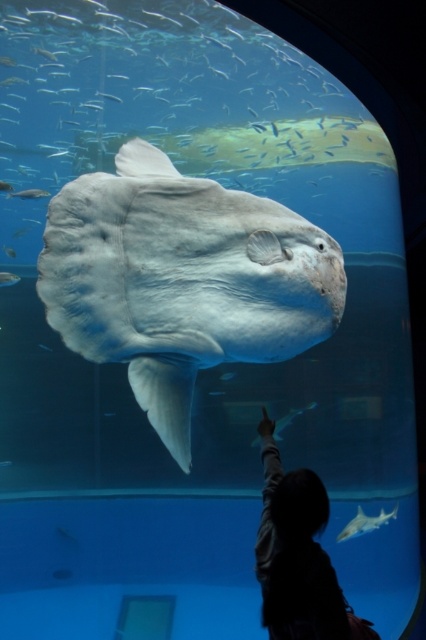
You are a marine biologist observing the aquarium tank. You notice the smooth gray shark at center and the translucent white fish at upper center. Which of these two marine creatures is positioned higher in the water column?

The translucent white fish at upper center is positioned higher in the water column than the smooth gray shark at center.

Looking at this image, you are an underwater photographer aiming to capture the silhouette fabric at lower center and the translucent white fish at upper center in a single shot. Based on their positions, can you determine which object is closer to the camera?

The silhouette fabric at lower center is below the translucent white fish at upper center, so the translucent white fish at upper center is closer to the camera.

You are an aquatic biologist observing the aquarium. You need to place a 1 meter wide net between the silhouette fabric at lower center and the translucent white fish at upper center. Can the net fit horizontally between them?

The silhouette fabric at lower center is wider than the translucent white fish at upper center. However, the question is about the space between them, not their widths. Since the description only provides their widths and not the distance between them, we cannot determine if the net will fit. More information about the distance between the two objects is needed to answer this question accurately.